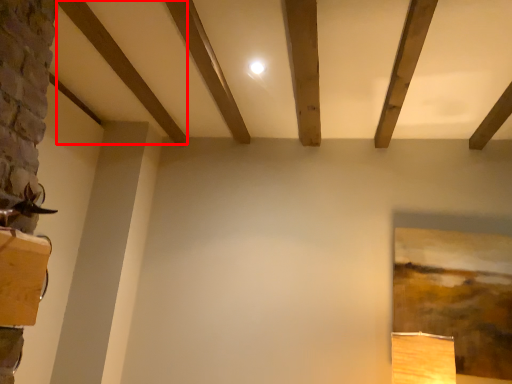
Question: From the image's perspective, where is plank (annotated by the red box) located relative to plank?

Choices:
 (A) above
 (B) below

Answer: (A)